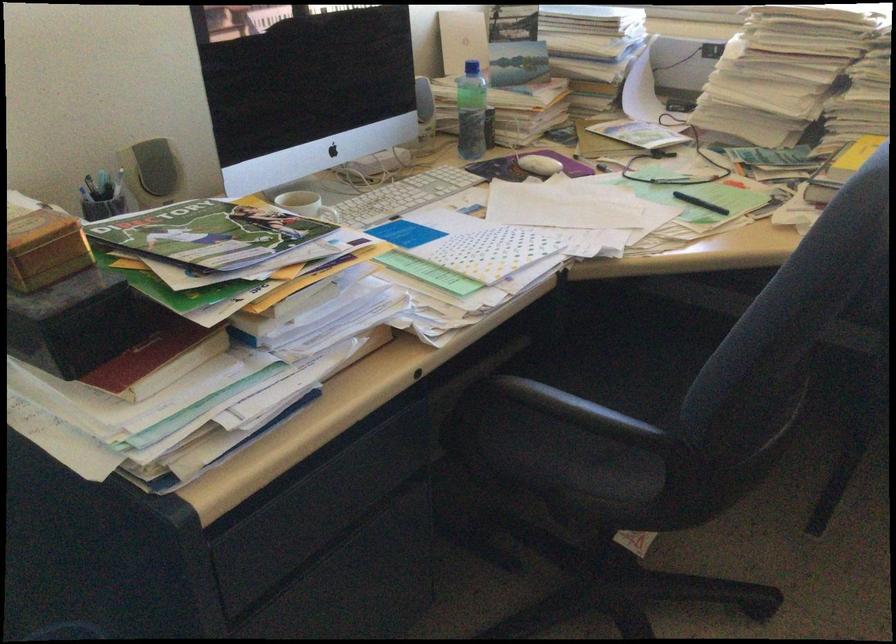
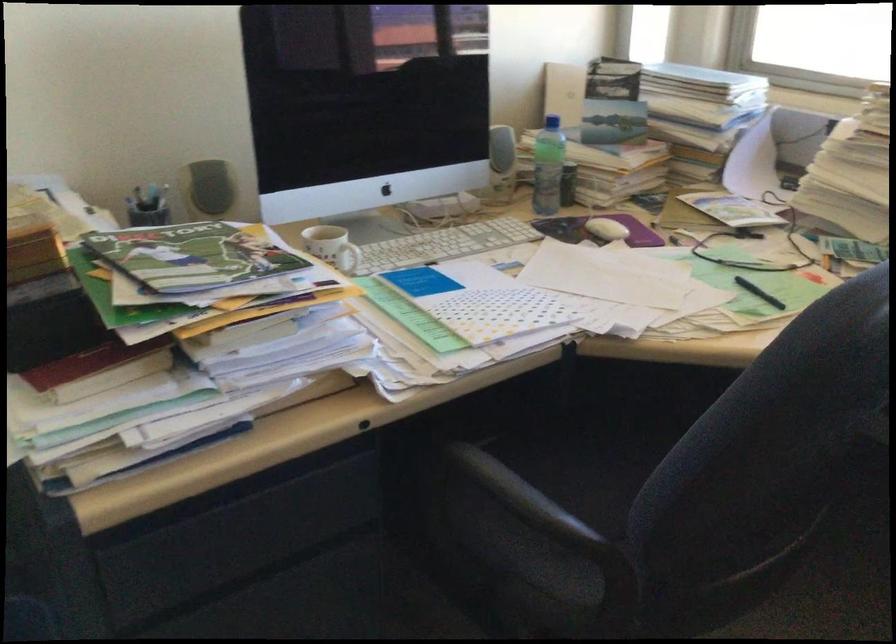
Question: The images are taken continuously from a first-person perspective. In which direction is your viewpoint rotating?

Choices:
 (A) Left
 (B) Right
 (C) Up
 (D) Down

Answer: (A)